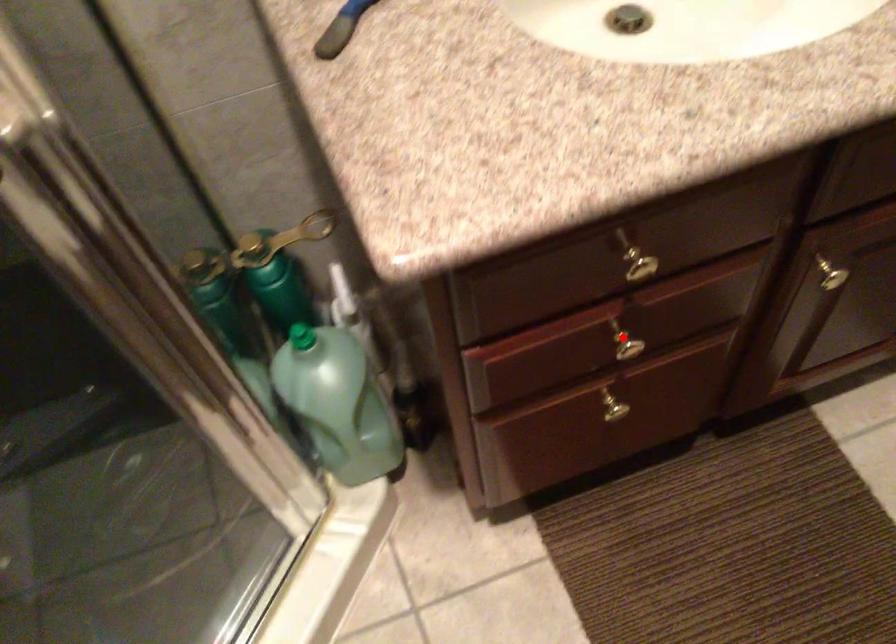
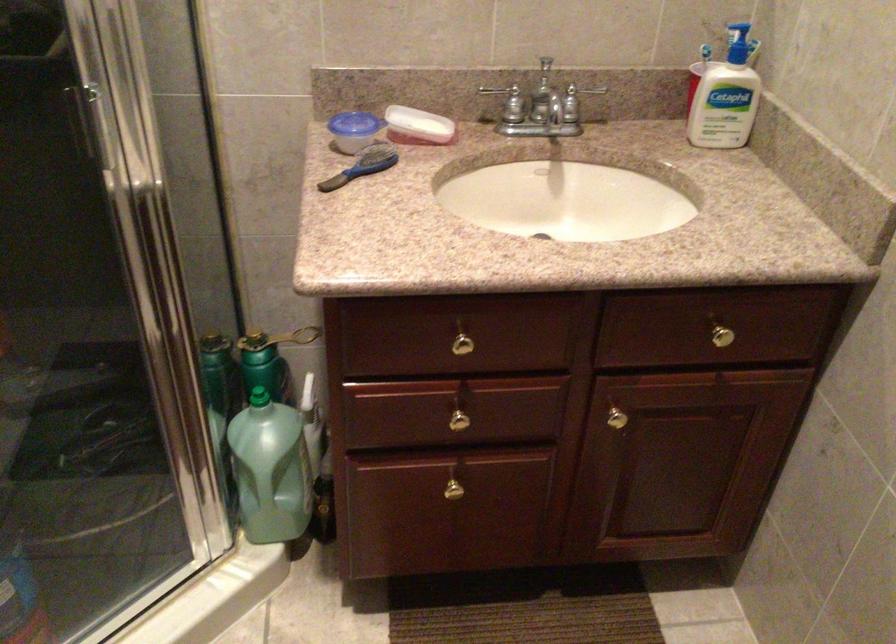
Find the pixel in the second image that matches the highlighted location in the first image.

(459, 415)